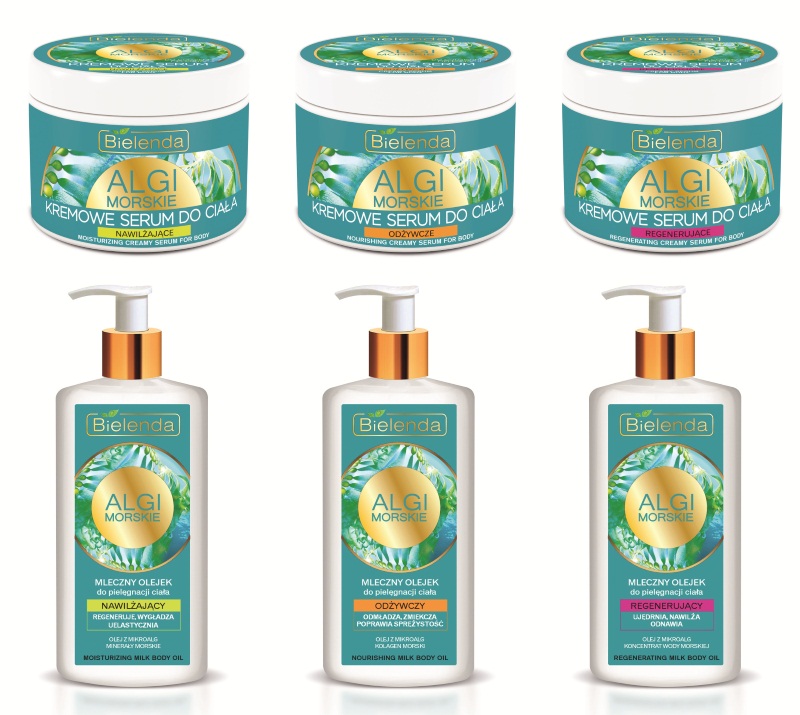
The height and width of the screenshot is (715, 800). Identify the location of personal care products. (141, 523), (194, 184), (400, 176), (414, 468), (630, 513), (676, 169).